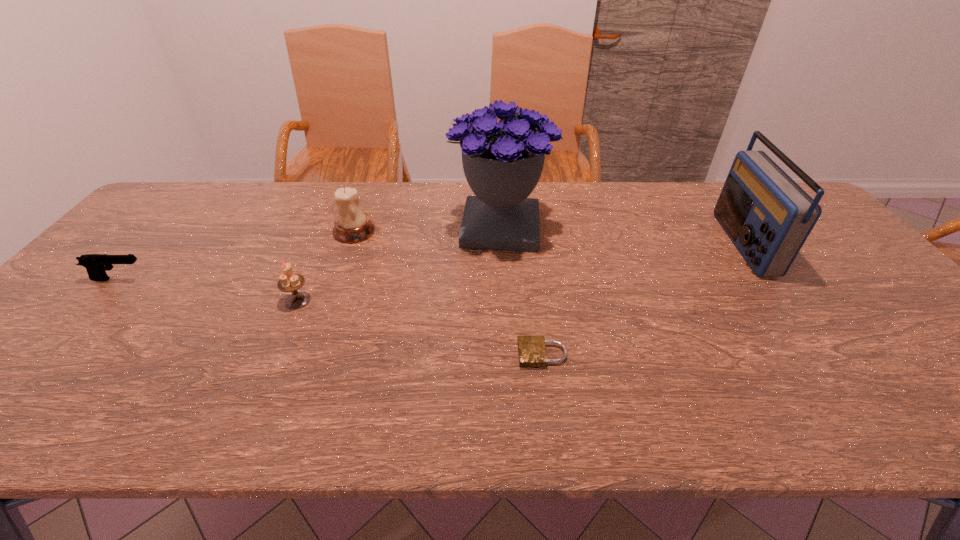
The height and width of the screenshot is (540, 960). Find the location of `free spot between the bouquet and the pistol`. free spot between the bouquet and the pistol is located at coordinates (310, 253).

This screenshot has width=960, height=540. Find the location of `free area in between the taller candle holder and the shorter candle holder`. free area in between the taller candle holder and the shorter candle holder is located at coordinates (326, 266).

Identify the location of free space that is in between the rightmost object and the shortest object. (642, 299).

Where is `free space between the second shortest object and the shortest object`? Image resolution: width=960 pixels, height=540 pixels. free space between the second shortest object and the shortest object is located at coordinates (331, 317).

Locate an element on the screen. This screenshot has height=540, width=960. empty space that is in between the fourth tallest object and the tallest object is located at coordinates (399, 264).

The height and width of the screenshot is (540, 960). In order to click on vacant area that lies between the second tallest object and the nearer candle holder in this screenshot , I will do coord(520,272).

Find the location of a particular element. Image resolution: width=960 pixels, height=540 pixels. empty space between the tallest object and the fifth tallest object is located at coordinates (310, 253).

Where is `unoccupied position between the shortest object and the shorter candle holder`? unoccupied position between the shortest object and the shorter candle holder is located at coordinates (420, 327).

At what (x,y) coordinates should I click in order to perform the action: click on vacant region between the third tallest object and the radio receiver. Please return your answer as a coordinate pair (x, y). Looking at the image, I should click on (548, 237).

Point out which object is positioned as the nearest to the bouquet. Please provide its 2D coordinates. Your answer should be formatted as a tuple, i.e. [(x, y)], where the tuple contains the x and y coordinates of a point satisfying the conditions above.

[(352, 225)]